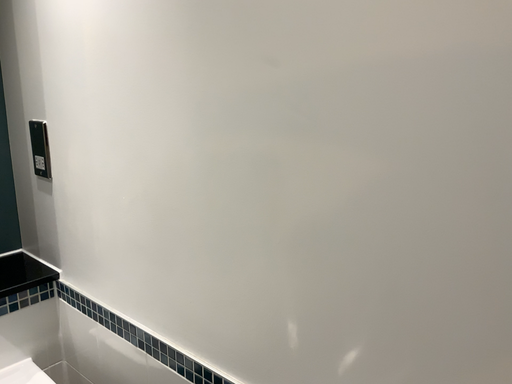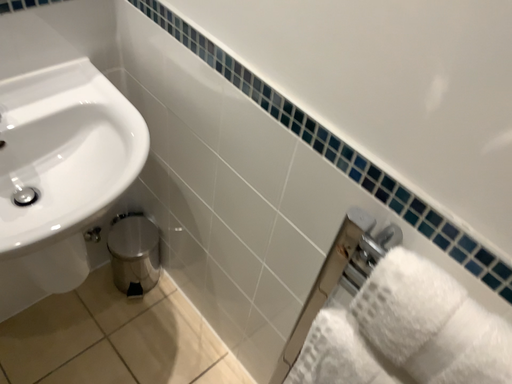
Question: How did the camera likely rotate when shooting the video?

Choices:
 (A) rotated upward
 (B) rotated downward

Answer: (B)